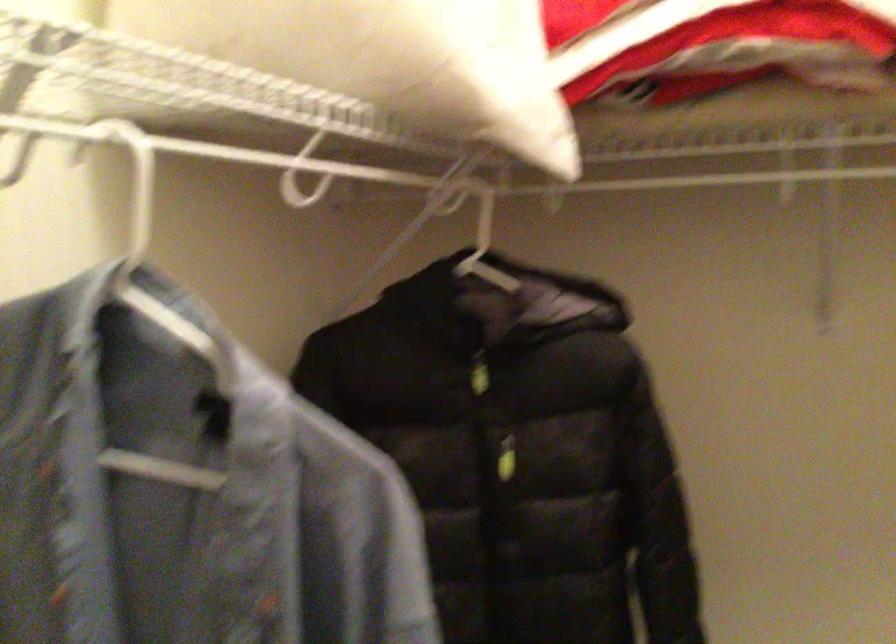
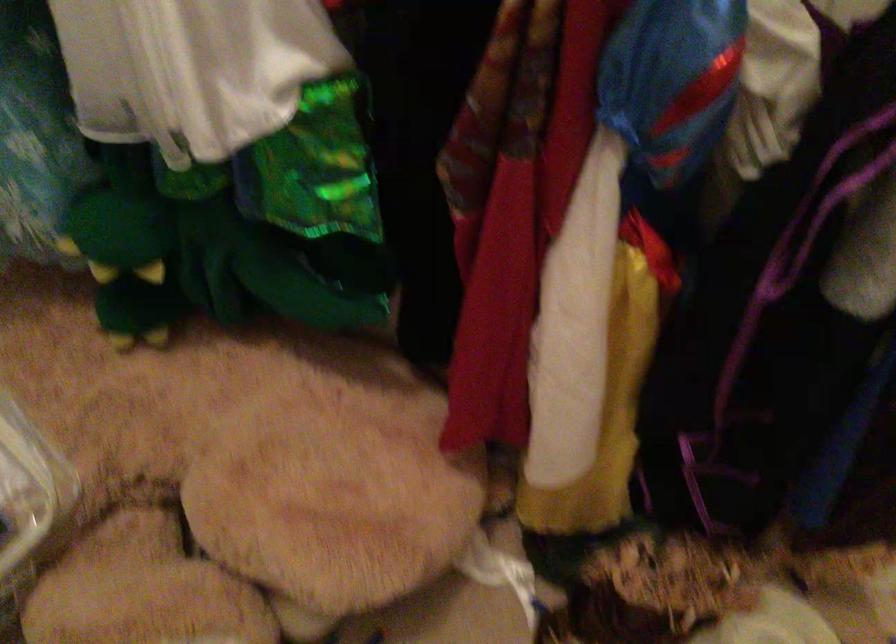
Based on the photo, how did the camera likely rotate?

The camera rotated toward right-down.